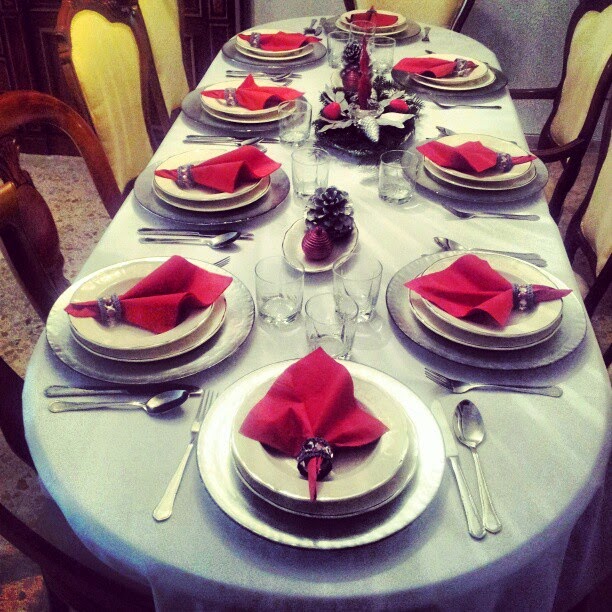
In order to click on napkins in this screenshot , I will do `click(133, 303)`, `click(322, 405)`, `click(469, 296)`, `click(270, 38)`, `click(252, 90)`, `click(228, 171)`, `click(478, 154)`, `click(430, 70)`, `click(386, 13)`.